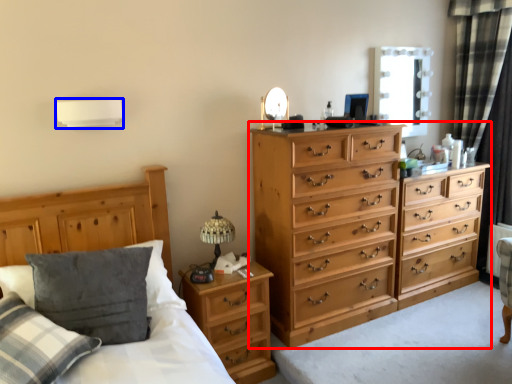
Question: Among these objects, which one is nearest to the camera, chest of drawers (highlighted by a red box) or lamp (highlighted by a blue box)?

Choices:
 (A) chest of drawers
 (B) lamp

Answer: (B)